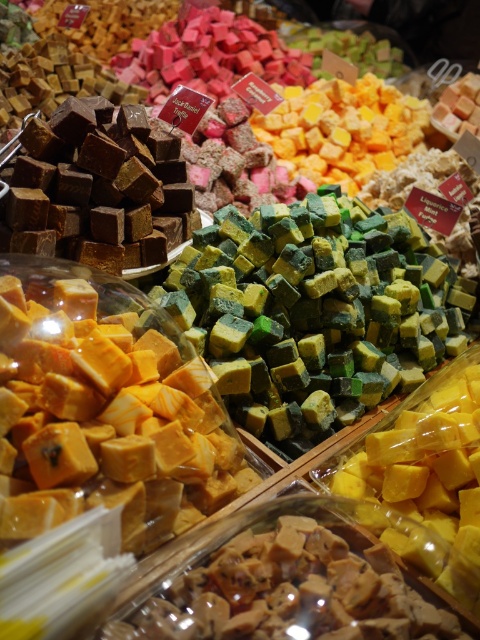
Question: Where is green matte fudge at center located in relation to matte brown fudge at center in the image?

Choices:
 (A) right
 (B) left

Answer: (A)

Question: Can you confirm if green matte fudge at center is bigger than matte brown fudge at center?

Choices:
 (A) yes
 (B) no

Answer: (A)

Question: Among these points, which one is nearest to the camera?

Choices:
 (A) (369, 321)
 (B) (294, 513)

Answer: (B)

Question: Is green matte fudge at center to the left of matte brown fudge at center from the viewer's perspective?

Choices:
 (A) no
 (B) yes

Answer: (A)

Question: Among these points, which one is nearest to the camera?

Choices:
 (A) (265, 317)
 (B) (336, 522)

Answer: (B)